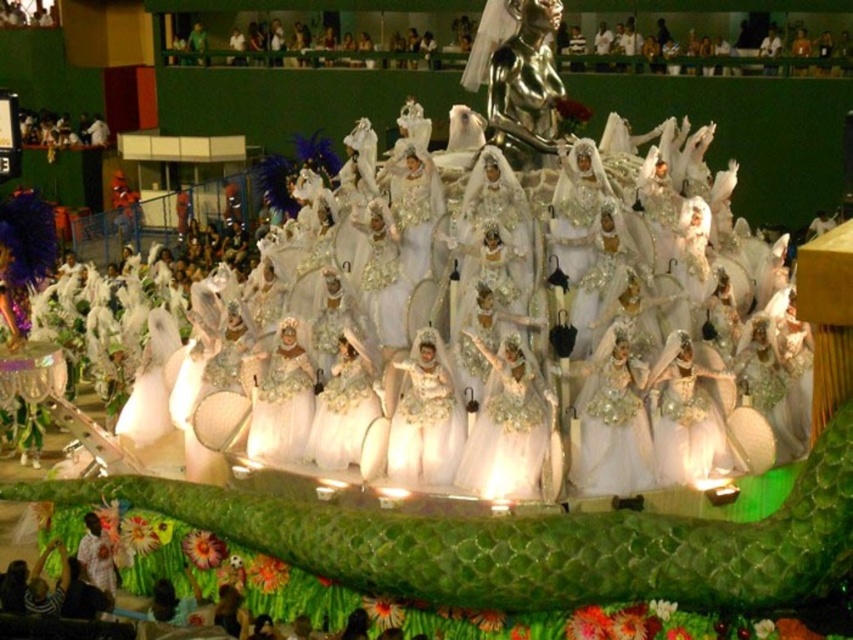
Is white tulle dress at center wider than ivory satin dress at center?

No, white tulle dress at center is not wider than ivory satin dress at center.

Can you confirm if white tulle dress at center is bigger than ivory satin dress at center?

No.

The width and height of the screenshot is (853, 640). I want to click on white tulle dress at center, so click(x=511, y=429).